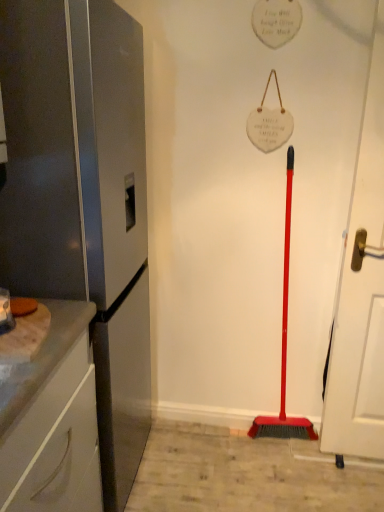
Question: Are white glossy cabinet at left and satin silver refrigerator at left far apart?

Choices:
 (A) yes
 (B) no

Answer: (B)

Question: From a real-world perspective, is white glossy cabinet at left positioned over satin silver refrigerator at left based on gravity?

Choices:
 (A) no
 (B) yes

Answer: (A)

Question: Is white glossy cabinet at left facing towards satin silver refrigerator at left?

Choices:
 (A) yes
 (B) no

Answer: (B)

Question: Is white glossy cabinet at left wider than satin silver refrigerator at left?

Choices:
 (A) no
 (B) yes

Answer: (A)

Question: Can you confirm if white glossy cabinet at left is bigger than satin silver refrigerator at left?

Choices:
 (A) no
 (B) yes

Answer: (A)

Question: From a real-world perspective, is white matte door at right positioned above or below satin silver refrigerator at left?

Choices:
 (A) below
 (B) above

Answer: (B)

Question: Considering the positions of point (380, 8) and point (89, 181), is point (380, 8) closer or farther from the camera than point (89, 181)?

Choices:
 (A) closer
 (B) farther

Answer: (B)

Question: Visually, is white matte door at right positioned to the left or to the right of satin silver refrigerator at left?

Choices:
 (A) left
 (B) right

Answer: (B)

Question: Which is correct: white matte door at right is inside satin silver refrigerator at left, or outside of it?

Choices:
 (A) inside
 (B) outside

Answer: (B)

Question: Considering the positions of satin silver refrigerator at left and white matte door at right in the image, is satin silver refrigerator at left bigger or smaller than white matte door at right?

Choices:
 (A) small
 (B) big

Answer: (B)

Question: Do you think satin silver refrigerator at left is within white matte door at right, or outside of it?

Choices:
 (A) inside
 (B) outside

Answer: (B)

Question: Is point tap(64, 2) closer or farther from the camera than point tap(365, 193)?

Choices:
 (A) closer
 (B) farther

Answer: (A)

Question: Would you say satin silver refrigerator at left is to the left or to the right of white matte door at right in the picture?

Choices:
 (A) left
 (B) right

Answer: (A)

Question: Considering the relative positions of white matte door at right and white glossy cabinet at left in the image provided, is white matte door at right to the left or to the right of white glossy cabinet at left?

Choices:
 (A) left
 (B) right

Answer: (B)

Question: Is white matte door at right wider or thinner than white glossy cabinet at left?

Choices:
 (A) thin
 (B) wide

Answer: (A)